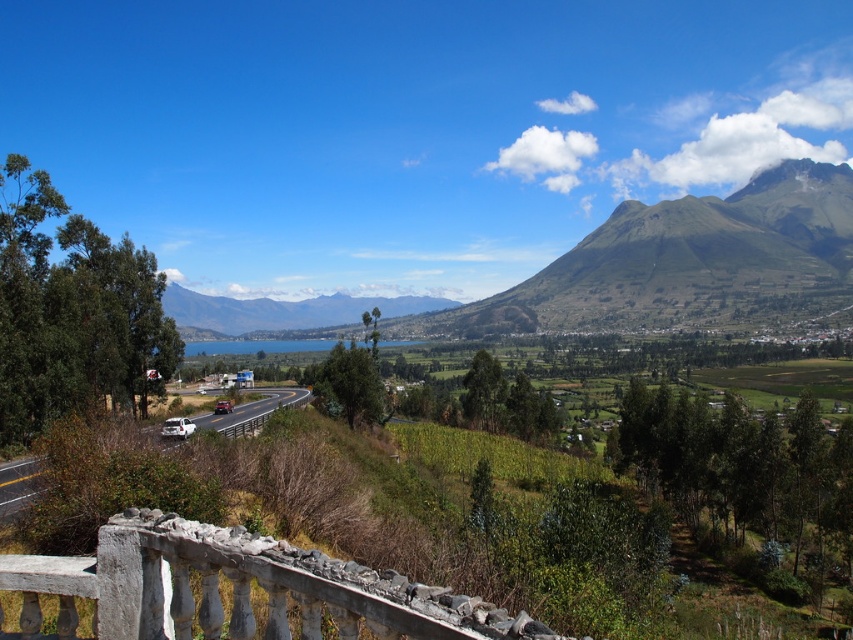
Is point (737, 253) positioned before point (9, 480)?

No, it is not.

Based on the photo, who is positioned more to the right, green grassy mountain at upper center or white asphalt road at center-left?

green grassy mountain at upper center is more to the right.

Where is `green grassy mountain at upper center`? This screenshot has height=640, width=853. green grassy mountain at upper center is located at coordinates (682, 260).